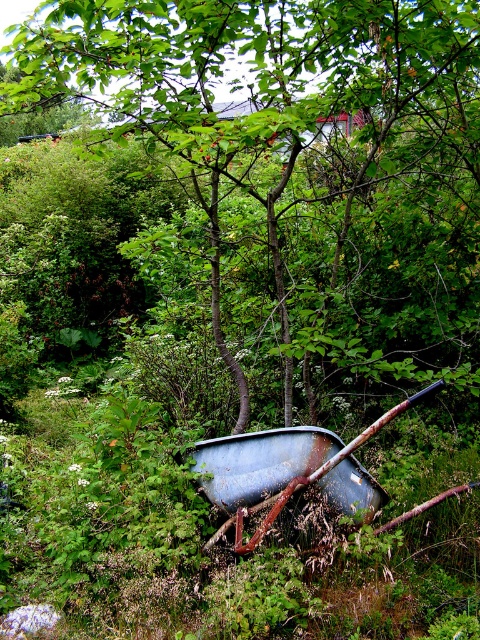
Who is more distant from viewer, (346, 68) or (307, 456)?

Positioned behind is point (346, 68).

Does green leafy tree at center come behind rusty metal wheelbarrow at center?

No, it is in front of rusty metal wheelbarrow at center.

Which is behind, point (431, 314) or point (243, 468)?

Point (431, 314)

Identify the location of green leafy tree at center. Image resolution: width=480 pixels, height=640 pixels. (300, 156).